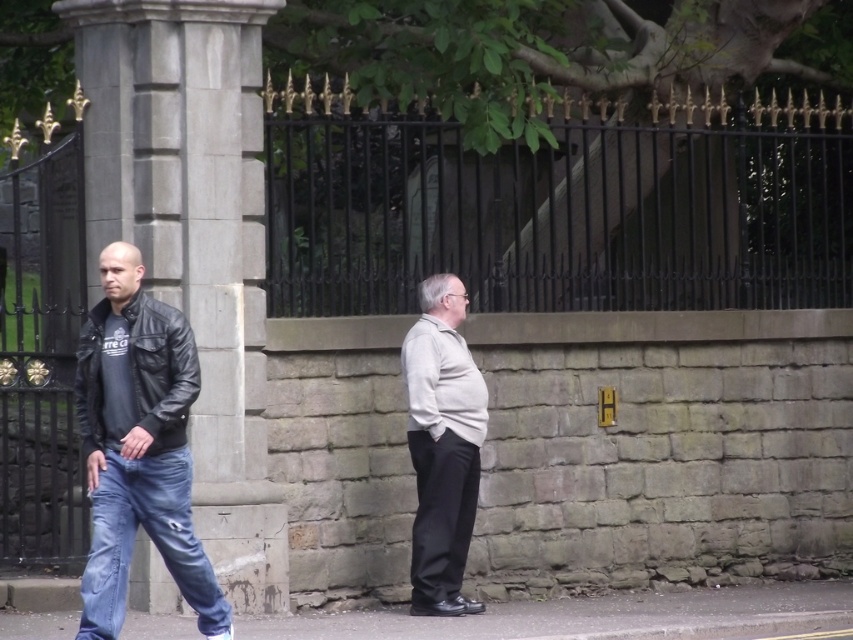
You are a fashion designer observing two people in the image. The first person is wearing a leather jacket at left, and the second is wearing a light beige sweater at center. Which clothing item is positioned higher on their respective bodies?

The leather jacket at left is positioned higher because it is above the light beige sweater at center.

You are a fashion designer observing two people in the image. You need to determine which clothing item would require more fabric to produce between the leather jacket at left and the light beige sweater at center. Which one would need more fabric?

The leather jacket at left is larger in size than the light beige sweater at center, so it would require more fabric to produce.

You are standing in front of the stone wall with the black wrought iron gate. There are two points marked on the wall. One is at coordinate point [457,349] and the other is at point [422,420]. Which point is closer to you?

Point [457,349] is further to the camera than point [422,420], so the point closer to you is point [422,420].